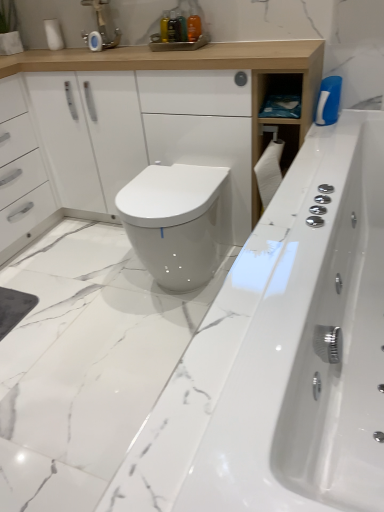
Locate an element on the screen. The height and width of the screenshot is (512, 384). space that is in front of white glossy bidet at center is located at coordinates (142, 346).